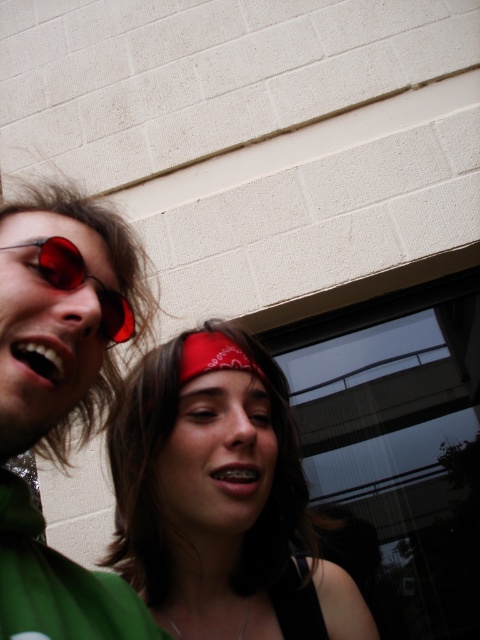
In the scene shown: Is matte red sunglasses at left smaller than matte red goggles at left?

No.

Does point (72, 196) come in front of point (7, 244)?

No, (72, 196) is behind (7, 244).

Find the location of a particular element. matte red sunglasses at left is located at coordinates (60, 396).

Can you confirm if red bandana at center is thinner than matte red sunglasses at left?

In fact, red bandana at center might be wider than matte red sunglasses at left.

What do you see at coordinates (218, 497) in the screenshot? Image resolution: width=480 pixels, height=640 pixels. I see `red bandana at center` at bounding box center [218, 497].

I want to click on red bandana at center, so click(x=218, y=497).

Is red bandana at center smaller than matte red goggles at left?

No, red bandana at center is not smaller than matte red goggles at left.

Which is below, red bandana at center or matte red goggles at left?

→ red bandana at center

Who is more forward, (149,577) or (79,257)?

Positioned in front is point (79,257).

Locate an element on the screen. red bandana at center is located at coordinates (218, 497).